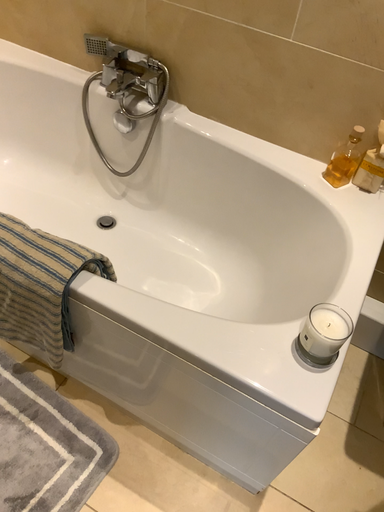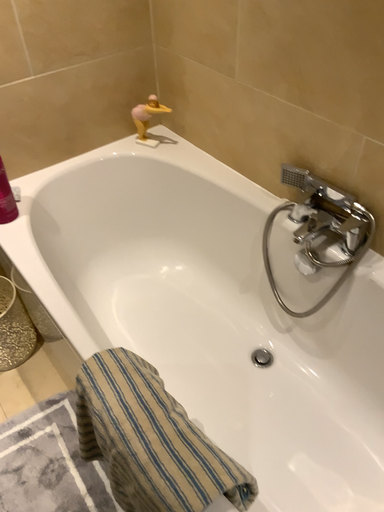
Question: How did the camera likely rotate when shooting the video?

Choices:
 (A) rotated left
 (B) rotated right

Answer: (A)